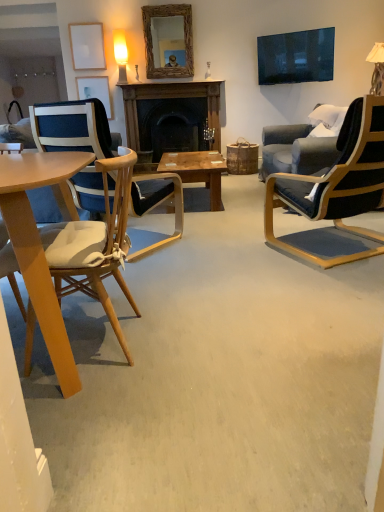
Question: Based on their positions, is light brown wood chair at left, which is counted as the 2th chair, starting from the right, located to the left or right of matte yellow glass lamp at upper center, which appears as the second lamp when viewed from the right?

Choices:
 (A) left
 (B) right

Answer: (B)

Question: Is light brown wood chair at left, which is counted as the 2th chair, starting from the right, spatially inside matte yellow glass lamp at upper center, which appears as the second lamp when viewed from the right, or outside of it?

Choices:
 (A) outside
 (B) inside

Answer: (A)

Question: Which is nearer to the matte white picture frame at upper left, the 2th picture frame when ordered from front to back?

Choices:
 (A) white matte picture frame at upper left, the first picture frame in the top-to-bottom sequence
 (B) matte yellow glass lamp at upper center, positioned as the 1th lamp in left-to-right order
 (C) matte blue wood chair at left, arranged as the third chair when viewed from the right
 (D) wooden coffee table at center
 (E) light brown wood chair at left, which appears as the 2th chair when viewed from the left

Answer: (A)

Question: Considering the real-world distances, which object is closest to the matte blue wood chair at left, arranged as the third chair when viewed from the right?

Choices:
 (A) woven wood mirror at upper center
 (B) light brown wood chair at left, which is counted as the 2th chair, starting from the right
 (C) matte yellow glass lamp at upper center, which appears as the second lamp when viewed from the right
 (D) wooden coffee table at center
 (E) matte white picture frame at upper left, acting as the 1th picture frame starting from the bottom

Answer: (D)